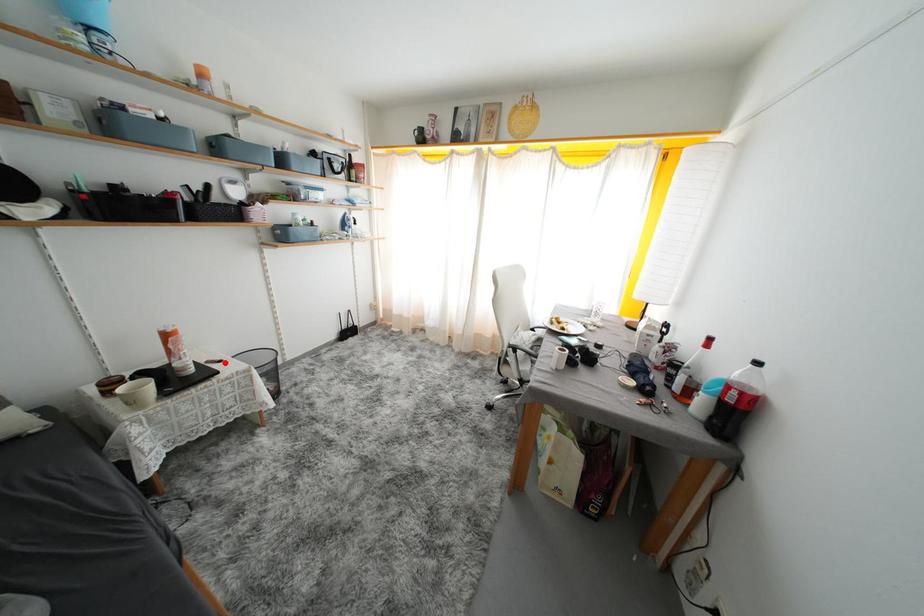
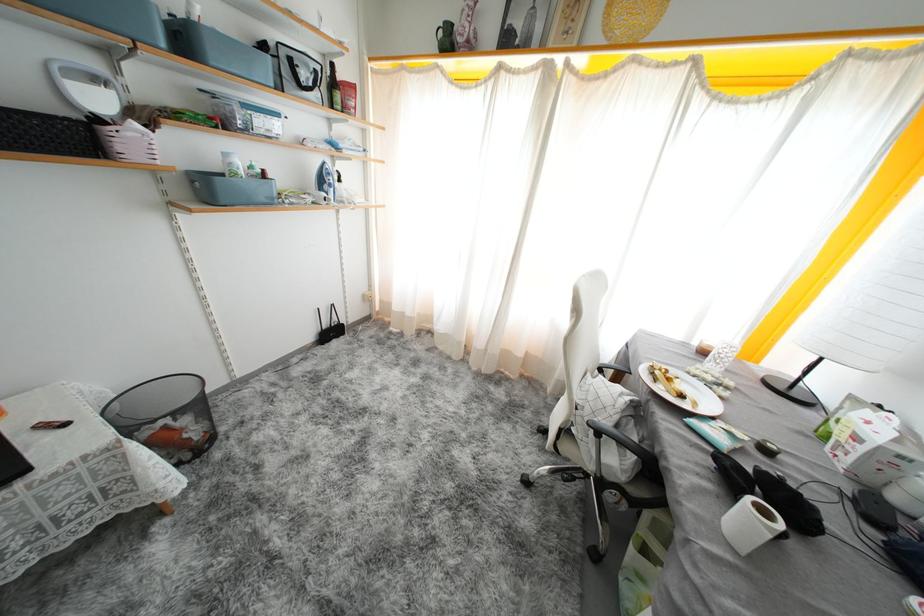
Locate, in the second image, the point that corresponds to the highlighted location in the first image.

(70, 423)